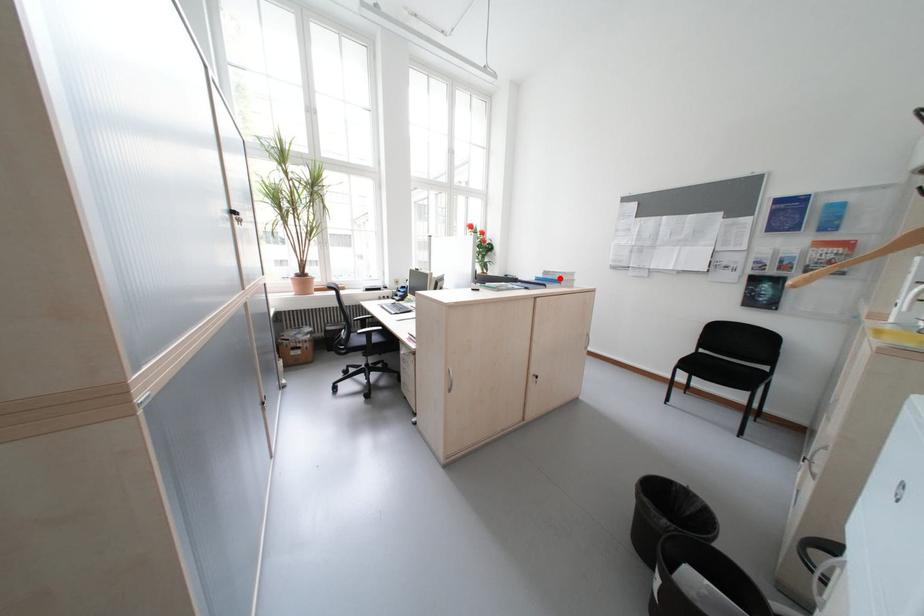
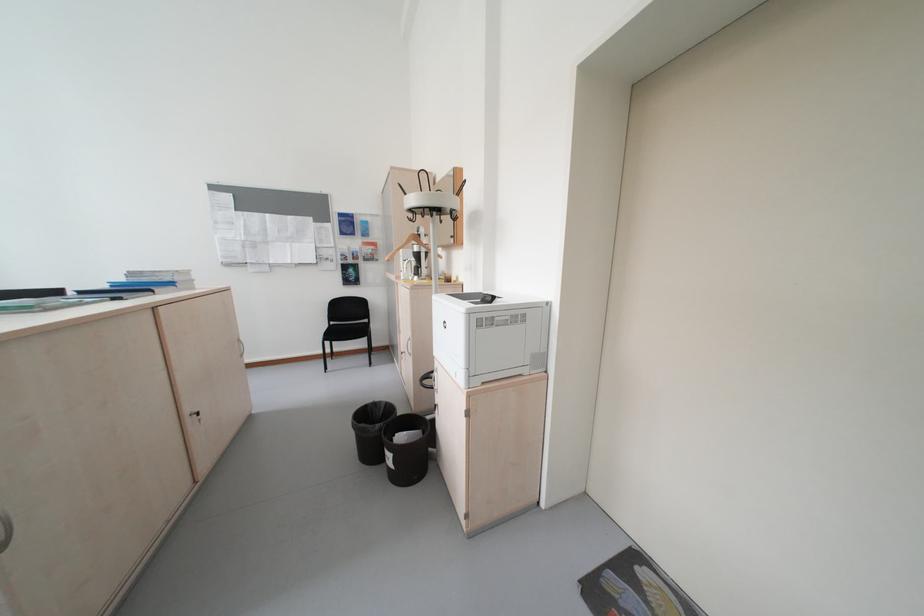
Locate, in the second image, the point that corresponds to the highlighted location in the first image.

(155, 281)